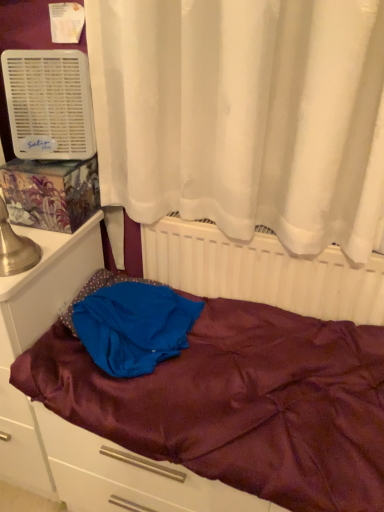
Question: From a real-world perspective, is white plastic air conditioner at upper left above or below matte white file cabinet at left?

Choices:
 (A) above
 (B) below

Answer: (A)

Question: In terms of size, does white plastic air conditioner at upper left appear bigger or smaller than matte white file cabinet at left?

Choices:
 (A) small
 (B) big

Answer: (A)

Question: Estimate the real-world distances between objects in this image. Which object is closer to the blue satin blanket at center?

Choices:
 (A) maroon satin bed at center
 (B) white plastic air conditioner at upper left
 (C) matte white file cabinet at left
 (D) white plastic radiator at center

Answer: (A)

Question: Estimate the real-world distances between objects in this image. Which object is closer to the matte white file cabinet at left?

Choices:
 (A) blue satin blanket at center
 (B) white plastic air conditioner at upper left
 (C) white plastic radiator at center
 (D) maroon satin bed at center

Answer: (D)